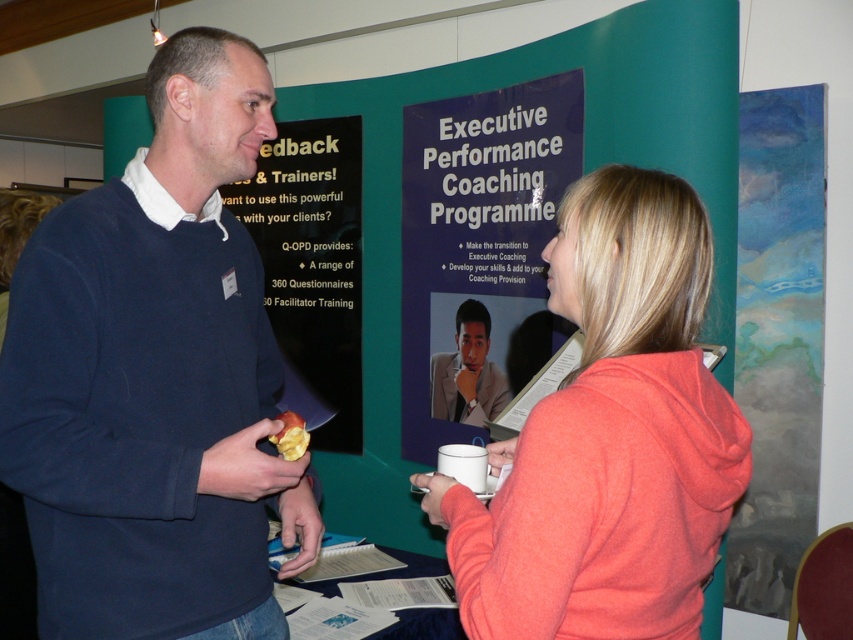
You are an event planner organizing a photo shoot for the event. You need to ensure that the coral fleece hoodie at upper right and the black glossy poster at center are both visible in the frame. Given their sizes, which object should you prioritize positioning closer to the camera to maintain clarity and detail?

The coral fleece hoodie at upper right should be positioned closer to the camera since it occupies less space than the black glossy poster at center, ensuring its smaller size remains visible and clear in the photo.

You are standing in the room where the two people are talking. You want to take a photo of the two posters on the teal wall. Which poster should you focus on first to ensure it is in focus, the one at point (495,189) or the one at point (770,592)?

You should focus on the poster at point (495,189) first because it is closer to you than the poster at point (770,592). Since it is closer, focusing on it first ensures it will be in focus before adjusting for the farther one.

You are an event planner who needs to ensure that the coral fleece hoodie at upper right and the black glossy poster at center are visible to attendees from a distance. Considering their sizes, which item might require additional lighting to ensure visibility?

The coral fleece hoodie at upper right has a lesser width compared to the black glossy poster at center, so the coral fleece hoodie at upper right might require additional lighting to ensure visibility.